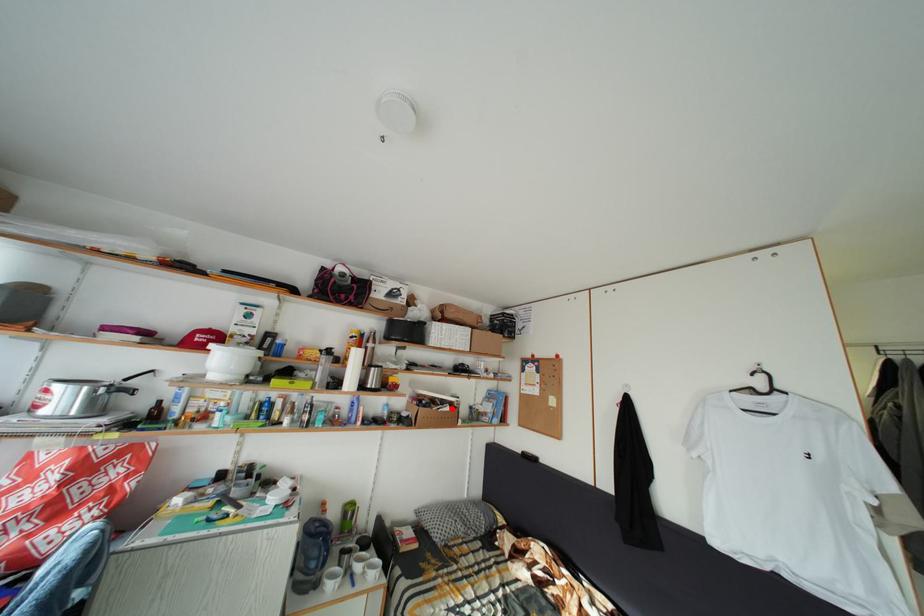
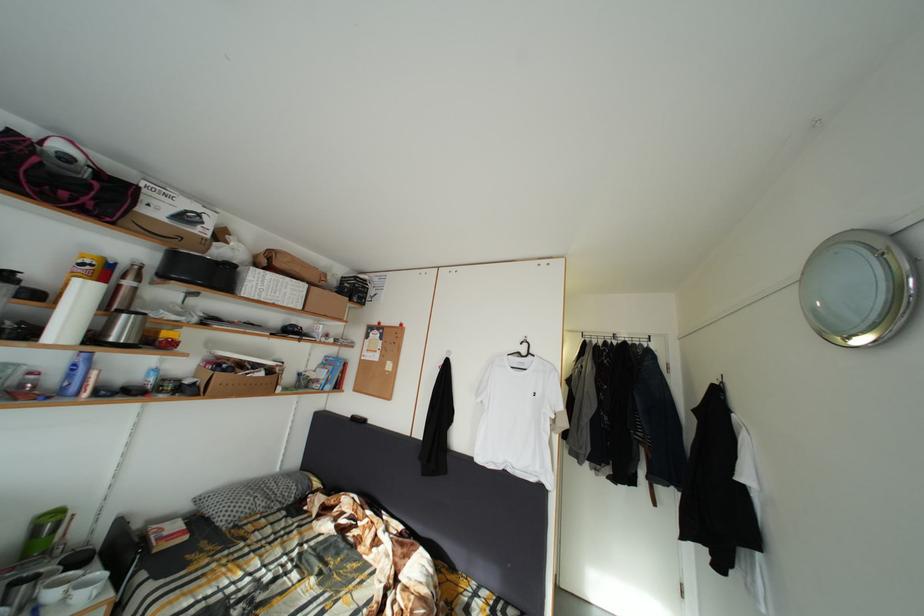
Locate, in the second image, the point that corresponds to the highlighted location in the first image.

(264, 373)